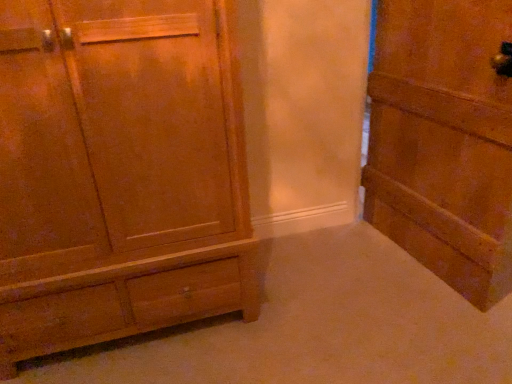
Where is `wooden door at right`? The image size is (512, 384). wooden door at right is located at coordinates (443, 141).

Measure the distance between wooden door at right and camera.

wooden door at right and camera are 4.36 feet apart.

Describe the element at coordinates (443, 141) in the screenshot. I see `wooden door at right` at that location.

What do you see at coordinates (119, 172) in the screenshot?
I see `wooden cabinet at left` at bounding box center [119, 172].

Identify the location of wooden cabinet at left. (119, 172).

In order to face wooden cabinet at left, should I rotate leftwards or rightwards?

A 19.396 degree turn to the left will do.

Identify the location of wooden door at right. Image resolution: width=512 pixels, height=384 pixels. (443, 141).

Based on the photo, in the image, is wooden door at right on the left side or the right side of wooden cabinet at left?

Clearly, wooden door at right is on the right of wooden cabinet at left in the image.

Which is behind, wooden door at right or wooden cabinet at left?

Positioned behind is wooden door at right.

Is point (401, 219) positioned after point (45, 22)?

Yes.

Looking at this image, from the image's perspective, is wooden door at right located above or below wooden cabinet at left?

wooden door at right is situated higher than wooden cabinet at left in the image.

From the picture: From a real-world perspective, which is physically above, wooden door at right or wooden cabinet at left?

wooden cabinet at left is physically above.

Can you confirm if wooden door at right is wider than wooden cabinet at left?

Incorrect, the width of wooden door at right does not surpass that of wooden cabinet at left.

From their relative heights in the image, would you say wooden door at right is taller or shorter than wooden cabinet at left?

In the image, wooden door at right appears to be shorter than wooden cabinet at left.

Looking at the image, does wooden door at right seem bigger or smaller compared to wooden cabinet at left?

Clearly, wooden door at right is smaller in size than wooden cabinet at left.

Based on the photo, can wooden cabinet at left be found inside wooden door at right?

Definitely not — wooden cabinet at left is not inside wooden door at right.

Is wooden door at right far away from wooden cabinet at left?

wooden door at right is far away from wooden cabinet at left.

Is wooden door at right facing away from wooden cabinet at left?

That's not correct — wooden door at right is not looking away from wooden cabinet at left.

How many degrees apart are the facing directions of wooden door at right and wooden cabinet at left?

The angle between the facing direction of wooden door at right and the facing direction of wooden cabinet at left is 81.9 degrees.

How distant is wooden door at right from wooden cabinet at left?

They are 3.47 feet apart.

The width and height of the screenshot is (512, 384). There is a wooden door at right. What are the coordinates of `the chest of drawers above it (from a real-world perspective)` in the screenshot? It's located at (119, 172).

Between wooden cabinet at left and wooden door at right, which one appears on the left side from the viewer's perspective?

wooden cabinet at left.

Which object is closer to the camera taking this photo, wooden cabinet at left or wooden door at right?

Positioned in front is wooden cabinet at left.

Considering the points (152, 88) and (447, 19), which point is behind, point (152, 88) or point (447, 19)?

The point (447, 19) is behind.

From the image's perspective, relative to wooden door at right, is wooden cabinet at left above or below?

Clearly, from the image's perspective, wooden cabinet at left is below wooden door at right.

From a real-world perspective, relative to wooden door at right, is wooden cabinet at left vertically above or below?

In terms of real-world spatial position, wooden cabinet at left is above wooden door at right.

Considering the sizes of objects wooden cabinet at left and wooden door at right in the image provided, who is wider, wooden cabinet at left or wooden door at right?

With larger width is wooden cabinet at left.

Considering the relative sizes of wooden cabinet at left and wooden door at right in the image provided, is wooden cabinet at left taller than wooden door at right?

Yes.

Looking at this image, based on their sizes in the image, would you say wooden cabinet at left is bigger or smaller than wooden door at right?

wooden cabinet at left is bigger than wooden door at right.

Is wooden cabinet at left inside the boundaries of wooden door at right, or outside?

wooden cabinet at left is not inside wooden door at right, it's outside.

Does wooden cabinet at left touch wooden door at right?

No, wooden cabinet at left is not beside wooden door at right.

From the picture: Is wooden cabinet at left looking in the opposite direction of wooden door at right?

No, wooden cabinet at left is not facing the opposite direction of wooden door at right.

Image resolution: width=512 pixels, height=384 pixels. Find the location of `door that is behind the wooden cabinet at left`. door that is behind the wooden cabinet at left is located at coordinates (443, 141).

Locate an element on the screen. The image size is (512, 384). door behind the wooden cabinet at left is located at coordinates (443, 141).

The image size is (512, 384). I want to click on chest of drawers in front of the wooden door at right, so click(119, 172).